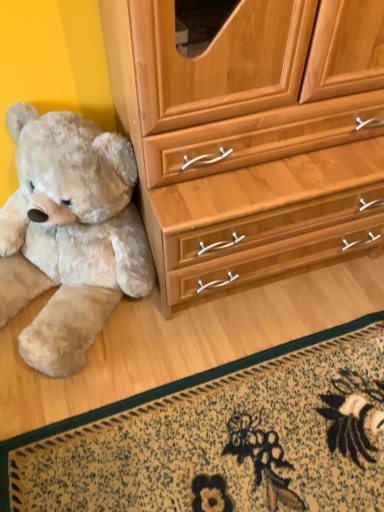
The width and height of the screenshot is (384, 512). What are the coordinates of `vacant space situated above floral carpet at lower center (from a real-world perspective)` in the screenshot? It's located at (236, 434).